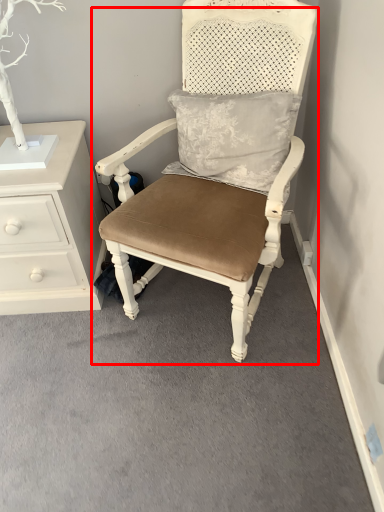
Question: From the image's perspective, where is chair (annotated by the red box) located in relation to chest of drawers in the image?

Choices:
 (A) below
 (B) above

Answer: (B)